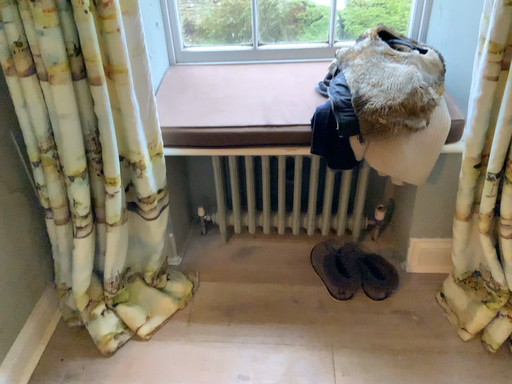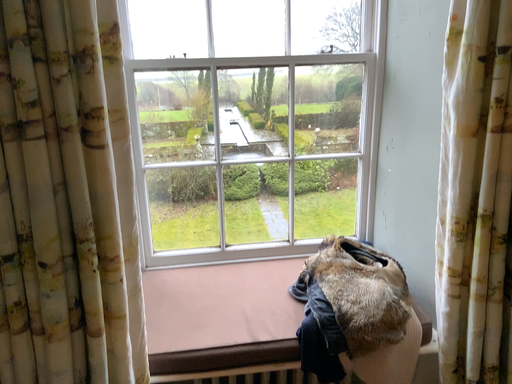
Question: Which way did the camera rotate in the video?

Choices:
 (A) rotated right
 (B) rotated left

Answer: (A)